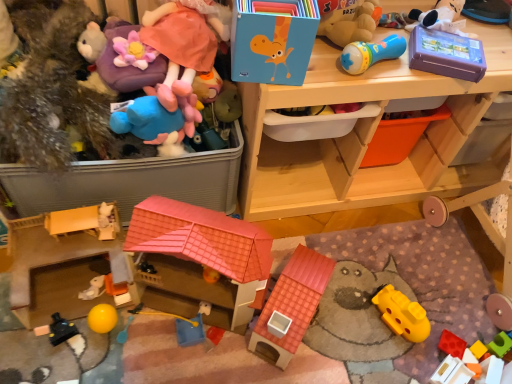
This screenshot has width=512, height=384. In order to click on empty space that is to the right of black plastic toy at lower left, the 13th toy viewed from the right in this screenshot , I will do `click(126, 343)`.